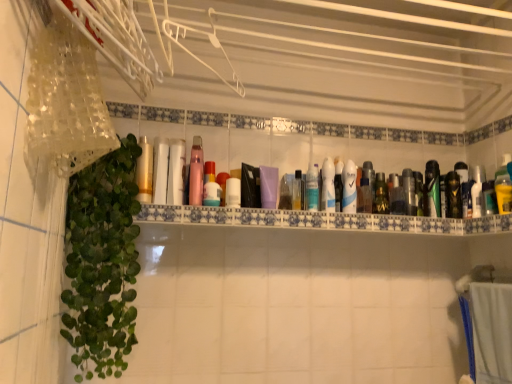
Question: Is pink glossy mouthwash at center, acting as the third mouthwash starting from the left, oriented towards green glossy mouthwash at center right, placed as the thirteenth mouthwash when sorted from left to right?

Choices:
 (A) no
 (B) yes

Answer: (A)

Question: Is pink glossy mouthwash at center, acting as the third mouthwash starting from the left, smaller than green glossy mouthwash at center right, positioned as the 6th mouthwash in right-to-left order?

Choices:
 (A) no
 (B) yes

Answer: (A)

Question: Are pink glossy mouthwash at center, which is the sixteenth mouthwash from right to left, and green glossy mouthwash at center right, placed as the thirteenth mouthwash when sorted from left to right, located far from each other?

Choices:
 (A) yes
 (B) no

Answer: (B)

Question: Is pink glossy mouthwash at center, which is the sixteenth mouthwash from right to left, in front of green glossy mouthwash at center right, placed as the thirteenth mouthwash when sorted from left to right?

Choices:
 (A) no
 (B) yes

Answer: (B)

Question: Does pink glossy mouthwash at center, acting as the third mouthwash starting from the left, touch green glossy mouthwash at center right, positioned as the 6th mouthwash in right-to-left order?

Choices:
 (A) yes
 (B) no

Answer: (B)

Question: Considering the positions of metallic gold mouthwash at right, acting as the second mouthwash starting from the right, and white glossy bottle at center, acting as the sixth mouthwash starting from the left, in the image, is metallic gold mouthwash at right, acting as the second mouthwash starting from the right, bigger or smaller than white glossy bottle at center, acting as the sixth mouthwash starting from the left,?

Choices:
 (A) small
 (B) big

Answer: (B)

Question: Is metallic gold mouthwash at right, acting as the second mouthwash starting from the right, in front of or behind white glossy bottle at center, arranged as the 13th mouthwash when viewed from the right, in the image?

Choices:
 (A) behind
 (B) front

Answer: (A)

Question: Is metallic gold mouthwash at right, acting as the second mouthwash starting from the right, situated inside white glossy bottle at center, arranged as the 13th mouthwash when viewed from the right, or outside?

Choices:
 (A) outside
 (B) inside

Answer: (A)

Question: Considering the relative positions of metallic gold mouthwash at right, acting as the second mouthwash starting from the right, and white glossy bottle at center, acting as the sixth mouthwash starting from the left, in the image provided, is metallic gold mouthwash at right, acting as the second mouthwash starting from the right, to the left or to the right of white glossy bottle at center, acting as the sixth mouthwash starting from the left,?

Choices:
 (A) right
 (B) left

Answer: (A)

Question: Is white glossy bottle at center, which is the seventeenth mouthwash in right-to-left order, bigger or smaller than blue fabric bath towel at lower right?

Choices:
 (A) big
 (B) small

Answer: (B)

Question: From a real-world perspective, is white glossy bottle at center, which is the 2th mouthwash from left to right, physically located above or below blue fabric bath towel at lower right?

Choices:
 (A) below
 (B) above

Answer: (B)

Question: Is white glossy bottle at center, which is the 2th mouthwash from left to right, spatially inside blue fabric bath towel at lower right, or outside of it?

Choices:
 (A) outside
 (B) inside

Answer: (A)

Question: Is point (169, 200) closer or farther from the camera than point (476, 340)?

Choices:
 (A) farther
 (B) closer

Answer: (B)

Question: In the image, is matte purple bottle at center, which ranks as the 12th mouthwash in right-to-left order, positioned in front of or behind translucent plastic bottle at center, which is the 8th mouthwash from left to right?

Choices:
 (A) front
 (B) behind

Answer: (A)

Question: Considering the positions of point (266, 200) and point (301, 208), is point (266, 200) closer or farther from the camera than point (301, 208)?

Choices:
 (A) closer
 (B) farther

Answer: (A)